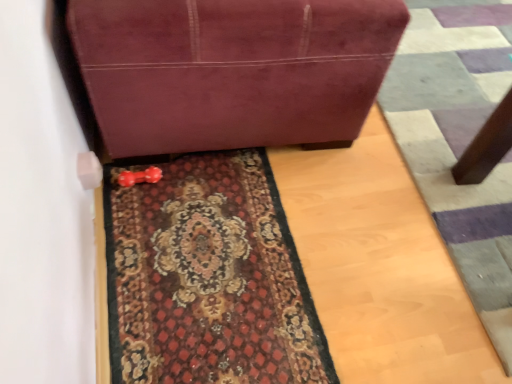
Question: Considering the relative sizes of carpeted mat at center and suede-like maroon sofa at upper center in the image provided, is carpeted mat at center wider than suede-like maroon sofa at upper center?

Choices:
 (A) no
 (B) yes

Answer: (A)

Question: Is suede-like maroon sofa at upper center surrounded by carpeted mat at center?

Choices:
 (A) yes
 (B) no

Answer: (B)

Question: Is carpeted mat at center positioned beyond the bounds of suede-like maroon sofa at upper center?

Choices:
 (A) yes
 (B) no

Answer: (A)

Question: Considering the relative positions of carpeted mat at center and suede-like maroon sofa at upper center in the image provided, is carpeted mat at center behind suede-like maroon sofa at upper center?

Choices:
 (A) yes
 (B) no

Answer: (A)

Question: Is carpeted mat at center next to suede-like maroon sofa at upper center?

Choices:
 (A) yes
 (B) no

Answer: (B)

Question: Choose the correct answer: Is suede-like maroon sofa at upper center inside carpeted doormat at lower center or outside it?

Choices:
 (A) inside
 (B) outside

Answer: (B)

Question: Is suede-like maroon sofa at upper center taller or shorter than carpeted doormat at lower center?

Choices:
 (A) tall
 (B) short

Answer: (A)

Question: Visually, is suede-like maroon sofa at upper center positioned to the left or to the right of carpeted doormat at lower center?

Choices:
 (A) right
 (B) left

Answer: (B)

Question: From a real-world perspective, is suede-like maroon sofa at upper center physically located above or below carpeted doormat at lower center?

Choices:
 (A) above
 (B) below

Answer: (A)

Question: Is carpeted mat at center situated inside carpeted doormat at lower center or outside?

Choices:
 (A) inside
 (B) outside

Answer: (B)

Question: Considering the positions of point (296, 319) and point (421, 97), is point (296, 319) closer or farther from the camera than point (421, 97)?

Choices:
 (A) closer
 (B) farther

Answer: (A)

Question: Considering the positions of carpeted mat at center and carpeted doormat at lower center in the image, is carpeted mat at center taller or shorter than carpeted doormat at lower center?

Choices:
 (A) tall
 (B) short

Answer: (B)

Question: From a real-world perspective, relative to carpeted doormat at lower center, is carpeted mat at center vertically above or below?

Choices:
 (A) below
 (B) above

Answer: (A)

Question: Does point (164, 292) appear closer or farther from the camera than point (206, 46)?

Choices:
 (A) farther
 (B) closer

Answer: (A)

Question: Looking at their shapes, would you say carpeted mat at center is wider or thinner than suede-like maroon sofa at upper center?

Choices:
 (A) wide
 (B) thin

Answer: (B)